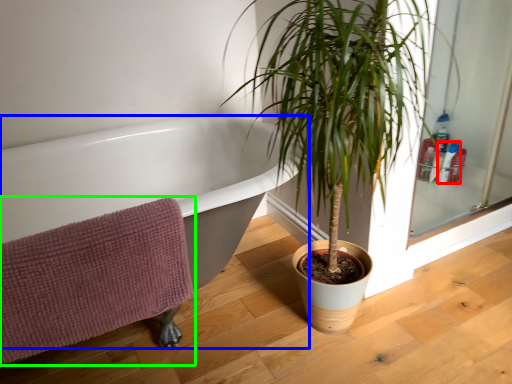
Question: Which object is the closest to the toiletry (highlighted by a red box)? Choose among these: bathtub (highlighted by a blue box) or bath towel (highlighted by a green box).

Choices:
 (A) bathtub
 (B) bath towel

Answer: (A)